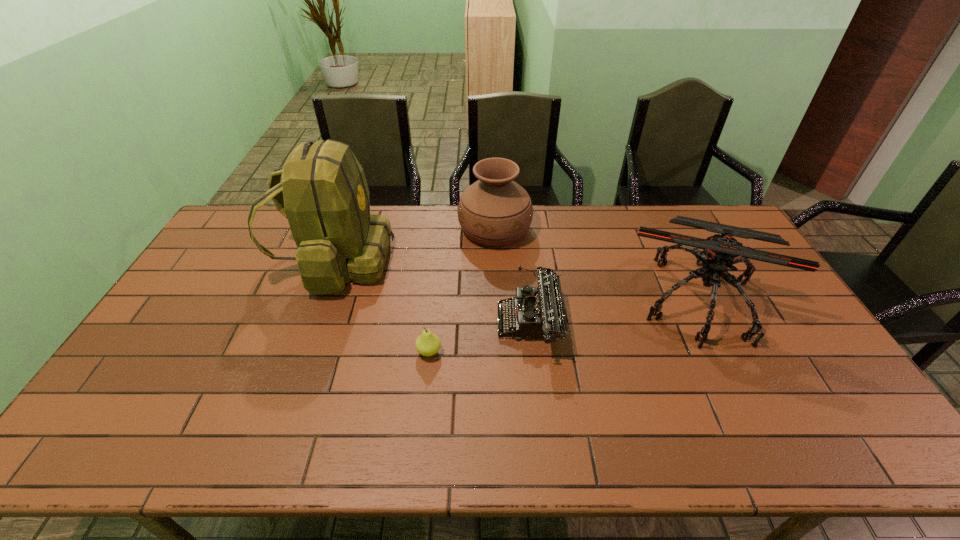
What are the coordinates of `free space located on the keyboard of the typewriter` in the screenshot? It's located at (381, 323).

Image resolution: width=960 pixels, height=540 pixels. Identify the location of free spot located on the keyboard of the typewriter. (364, 323).

Locate an element on the screen. free location located on the back of the second object from left to right is located at coordinates (439, 259).

In order to click on backpack present at the far edge in this screenshot , I will do `click(325, 197)`.

This screenshot has width=960, height=540. Find the location of `urn at the far edge`. urn at the far edge is located at coordinates (494, 211).

This screenshot has width=960, height=540. What are the coordinates of `object located in the right edge section of the desktop` in the screenshot? It's located at (720, 252).

Locate an element on the screen. The width and height of the screenshot is (960, 540). vacant space at the far edge is located at coordinates (415, 233).

This screenshot has height=540, width=960. Identify the location of free space at the near edge of the desktop. (285, 443).

In the image, there is a desktop. Where is `vacant space at the left edge`? This screenshot has width=960, height=540. vacant space at the left edge is located at coordinates (201, 266).

The image size is (960, 540). In order to click on vacant space at the right edge of the desktop in this screenshot , I will do `click(783, 310)`.